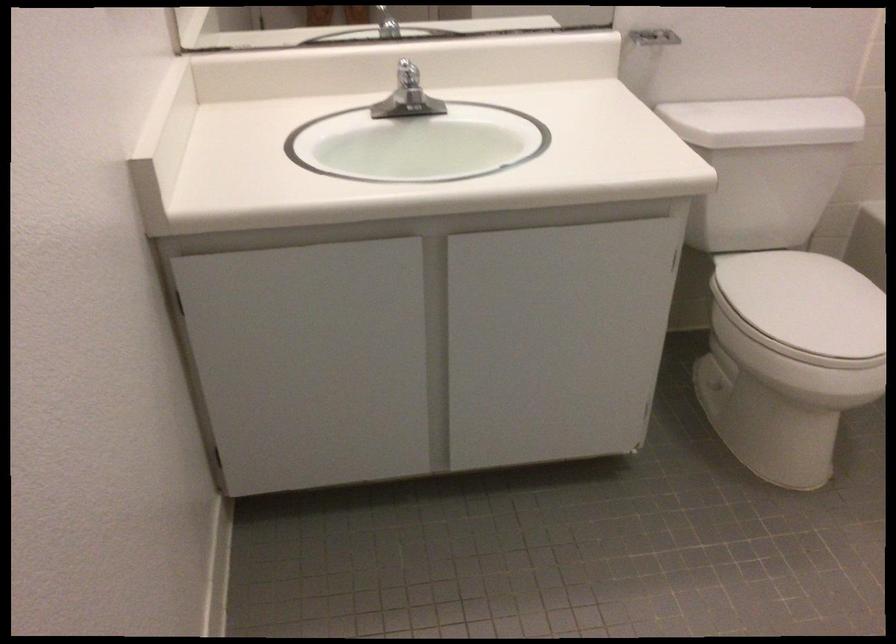
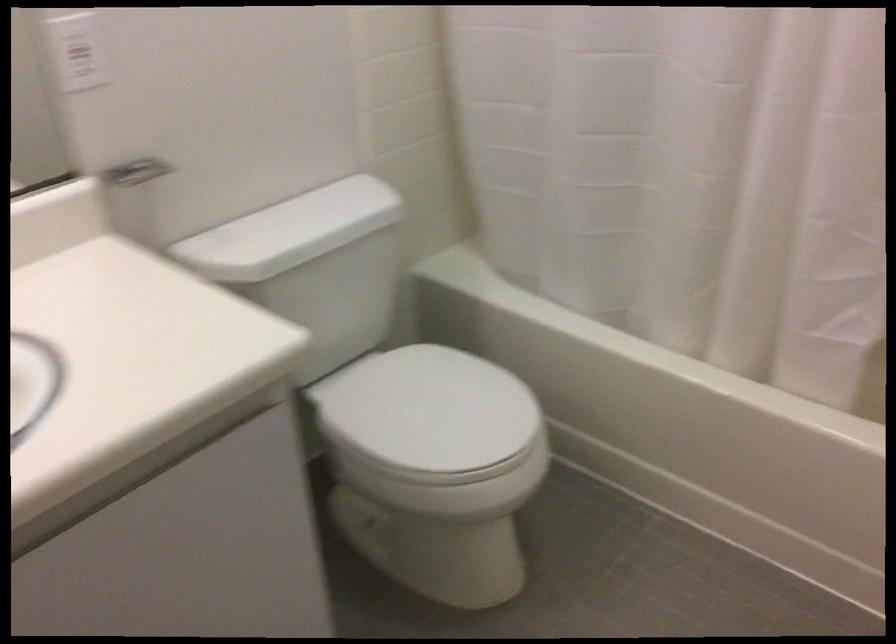
Question: The camera is either moving clockwise (left) or counter-clockwise (right) around the object. The first image is from the beginning of the video and the second image is from the end. Is the camera moving left or right when shooting the video?

Choices:
 (A) Left
 (B) Right

Answer: (A)